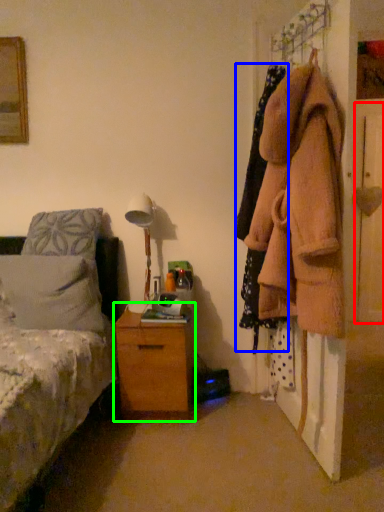
Question: Estimate the real-world distances between objects in this image. Which object is farther from door (highlighted by a red box), clothing (highlighted by a blue box) or chest of drawers (highlighted by a green box)?

Choices:
 (A) clothing
 (B) chest of drawers

Answer: (B)